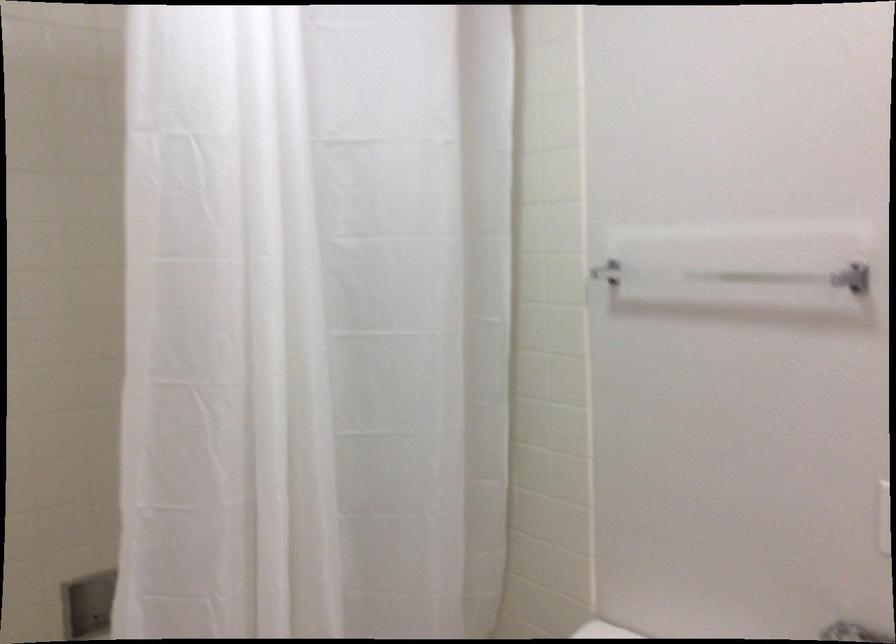
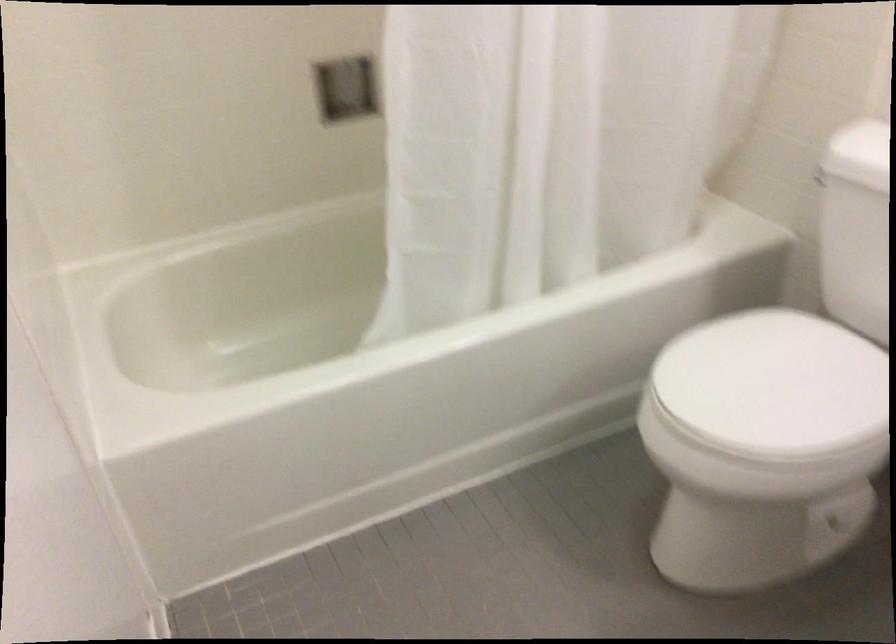
Question: The first image is from the beginning of the video and the second image is from the end. How did the camera likely rotate when shooting the video?

Choices:
 (A) Left
 (B) Right
 (C) Up
 (D) Down

Answer: (D)